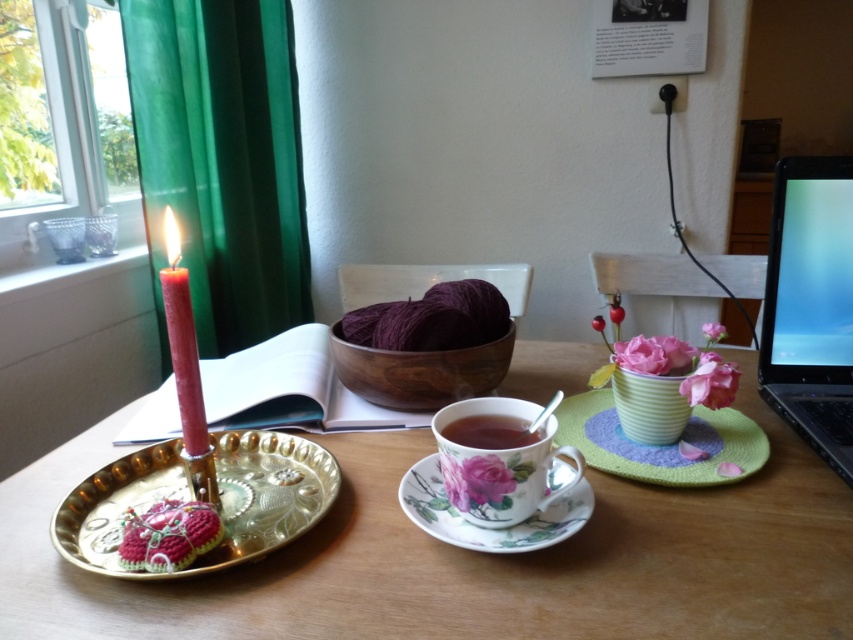
Is porcelain floral teacup at center below purple yarn at center?

Correct, porcelain floral teacup at center is located below purple yarn at center.

Which is more to the left, porcelain floral teacup at center or purple yarn at center?

purple yarn at center is more to the left.

What do you see at coordinates (498, 461) in the screenshot? I see `porcelain floral teacup at center` at bounding box center [498, 461].

In order to click on porcelain floral teacup at center in this screenshot , I will do `click(498, 461)`.

Who is lower down, sleek black laptop at right or floral porcelain saucer at center?

floral porcelain saucer at center is lower down.

The image size is (853, 640). I want to click on sleek black laptop at right, so click(810, 305).

Between gold metallic platter at left and purple yarn at center, which one has less height?

gold metallic platter at left is shorter.

Is point (107, 520) more distant than point (483, 289)?

No, it is not.

Between point (175, 474) and point (461, 308), which one is positioned in front?

Positioned in front is point (175, 474).

This screenshot has width=853, height=640. What are the coordinates of `gold metallic platter at left` in the screenshot? It's located at (186, 497).